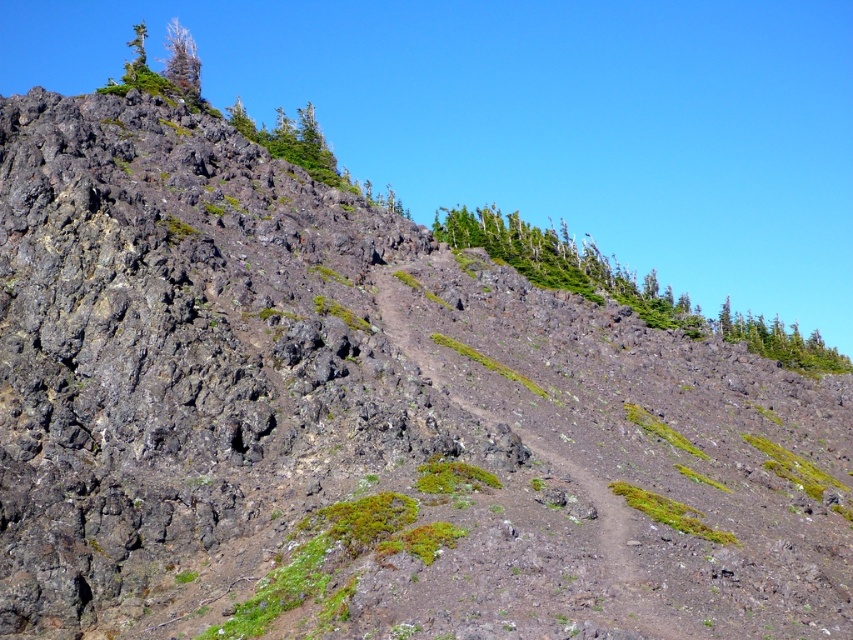
Question: Does green leafy trees at upper right have a greater width compared to dirt path at center?

Choices:
 (A) no
 (B) yes

Answer: (B)

Question: Where is green mossy tree at upper left located in relation to green leafy tree at upper left in the image?

Choices:
 (A) right
 (B) left

Answer: (A)

Question: Is green leafy trees at upper right above dirt path at center?

Choices:
 (A) no
 (B) yes

Answer: (B)

Question: Which is farther from the dirt path at center?

Choices:
 (A) green mossy tree at upper left
 (B) green leafy trees at upper right
 (C) green leafy tree at upper left

Answer: (B)

Question: Among these points, which one is farthest from the camera?

Choices:
 (A) click(144, 60)
 (B) click(169, 72)
 (C) click(582, 296)
 (D) click(433, 376)

Answer: (A)

Question: Which object appears farthest from the camera in this image?

Choices:
 (A) dirt path at center
 (B) green leafy tree at upper left
 (C) green mossy tree at upper left

Answer: (C)